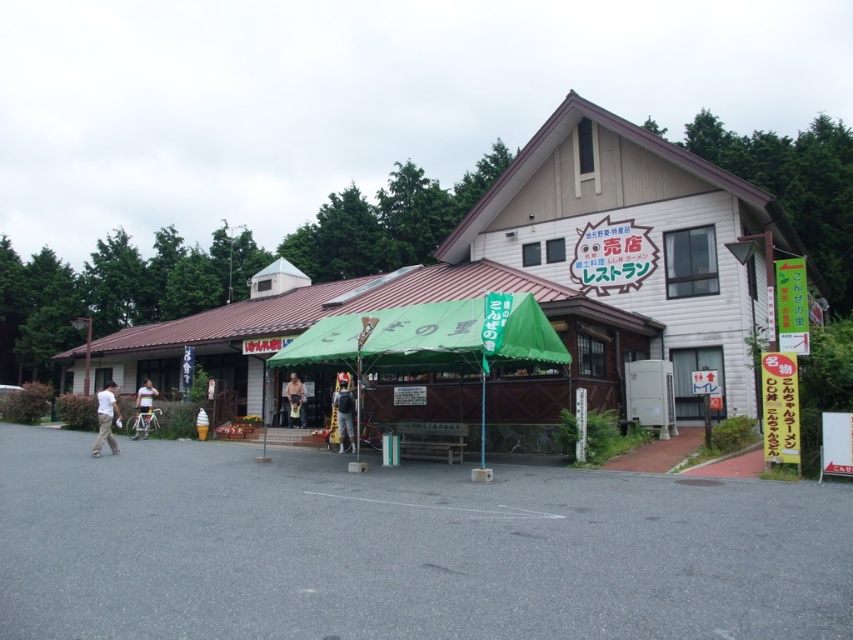
Question: Estimate the real-world distances between objects in this image. Which object is farther from the wooden tent at center?

Choices:
 (A) white cotton shirt at lower left
 (B) denim jacket at center

Answer: (B)

Question: Does wooden restaurant at center have a greater width compared to white bicycle at left?

Choices:
 (A) no
 (B) yes

Answer: (B)

Question: Which of the following is the closest to the observer?

Choices:
 (A) white cotton shirt at lower left
 (B) wooden restaurant at center
 (C) green fabric canopy at center

Answer: (B)

Question: Is wooden restaurant at center below green fabric canopy at center?

Choices:
 (A) yes
 (B) no

Answer: (B)

Question: Estimate the real-world distances between objects in this image. Which object is closer to the wooden restaurant at center?

Choices:
 (A) light brown wooden bench at center
 (B) green fabric canopy at center

Answer: (A)

Question: Is wooden restaurant at center above white cotton shirt at lower left?

Choices:
 (A) yes
 (B) no

Answer: (A)